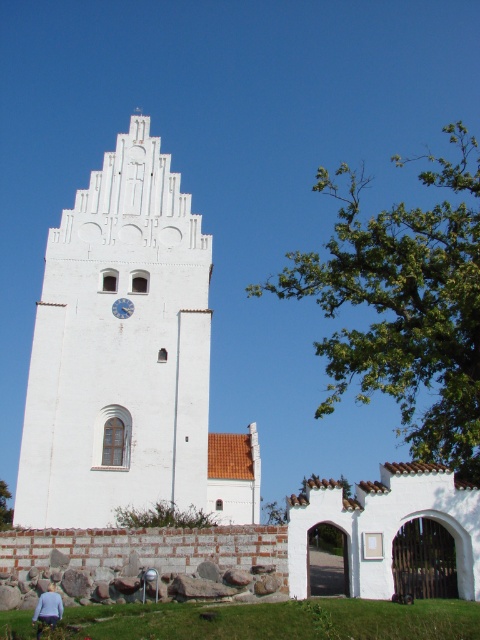
Question: Which point appears closest to the camera in this image?

Choices:
 (A) (168, 493)
 (B) (421, 371)
 (C) (3, 492)
 (D) (122, 304)

Answer: (A)

Question: Is white stone church at center thinner than green leafy tree at upper right?

Choices:
 (A) no
 (B) yes

Answer: (B)

Question: Is green leafy tree at upper right further to camera compared to green leafy tree at upper center?

Choices:
 (A) yes
 (B) no

Answer: (B)

Question: Among these points, which one is farthest from the camera?

Choices:
 (A) (127, 317)
 (B) (409, 397)

Answer: (B)

Question: Estimate the real-world distances between objects in this image. Which object is farther from the white matte clock at center?

Choices:
 (A) green leafy tree at upper center
 (B) white stone church at center

Answer: (A)

Question: From the image, what is the correct spatial relationship of green leafy tree at upper right in relation to white matte clock at center?

Choices:
 (A) left
 (B) right

Answer: (B)